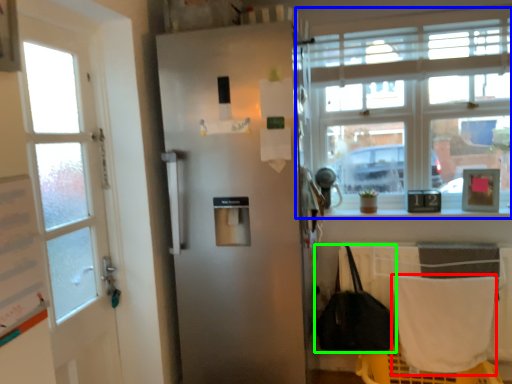
Question: Which object is positioned farthest from blanket (highlighted by a red box)? Select from window (highlighted by a blue box) and handbag (highlighted by a green box).

Choices:
 (A) window
 (B) handbag

Answer: (A)